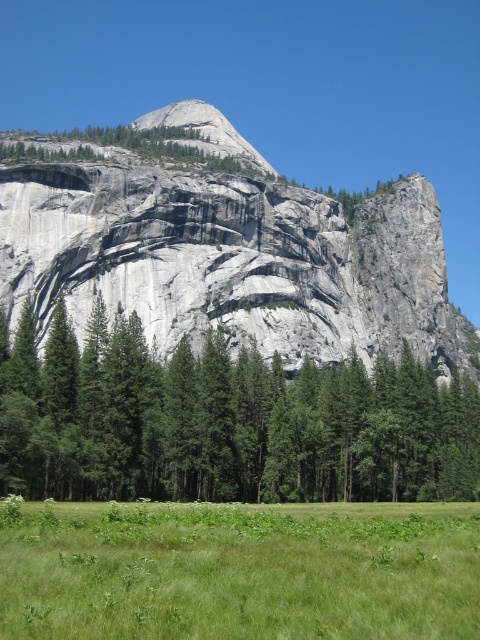
You are standing in the meadow and see the point marked at coordinates (224,420). What object is located at that point?

The green matte tree at center is located at the point marked at coordinates (224,420).

You are standing at the origin point of the coordinate system in the image. You want to walk towards the green matte tree at center. Which direction should you head in?

The green matte tree at center is located at coordinate point 0.659 on the x axis and 0.467 on the y axis. Since you are at the origin point, you should head towards the positive x and positive y direction to reach the green matte tree at center.